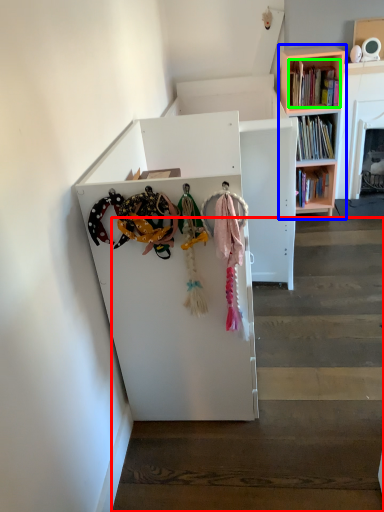
Question: Based on their relative distances, which object is nearer to stairwell (highlighted by a red box)? Choose from bookcase (highlighted by a blue box) and book (highlighted by a green box).

Choices:
 (A) bookcase
 (B) book

Answer: (B)